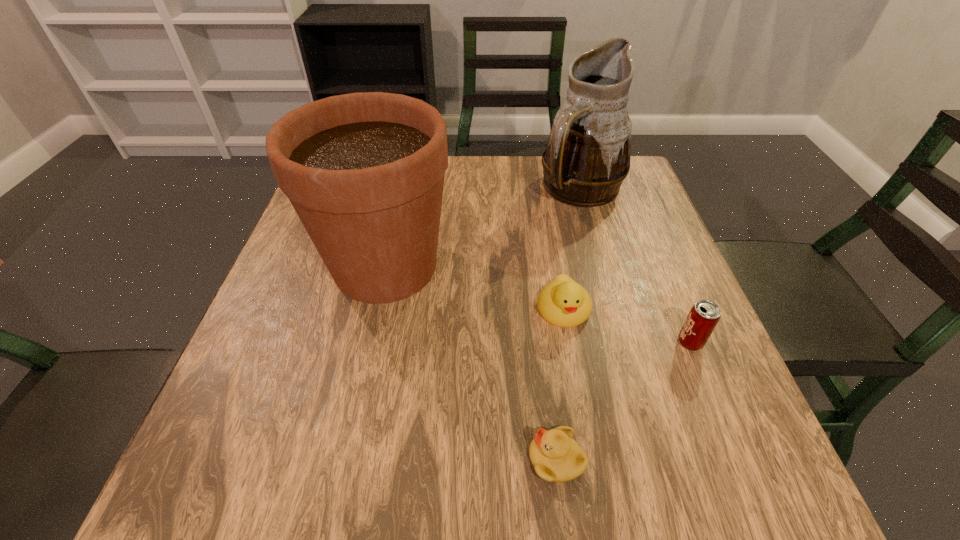
Locate an element on the screen. The image size is (960, 540). free space at the near edge of the desktop is located at coordinates (315, 478).

Where is `blank space at the left edge of the desktop`? blank space at the left edge of the desktop is located at coordinates (264, 310).

The image size is (960, 540). Find the location of `free space at the right edge`. free space at the right edge is located at coordinates (653, 278).

Identify the location of vacant space at the near left corner of the desktop. (x=225, y=461).

What are the coordinates of `vacant space at the far right corner` in the screenshot? It's located at (618, 195).

This screenshot has height=540, width=960. I want to click on vacant space at the near right corner of the desktop, so click(x=705, y=475).

What are the coordinates of `free space between the flowerpot and the pitcher` in the screenshot? It's located at (484, 228).

This screenshot has width=960, height=540. Identify the location of vacant space that's between the nearer duckling and the beer can. (623, 401).

Find the location of a particular element. Image resolution: width=960 pixels, height=540 pixels. empty space between the farthest object and the beer can is located at coordinates (636, 266).

What are the coordinates of `blank region between the shorter duckling and the taller duckling` in the screenshot? It's located at (560, 384).